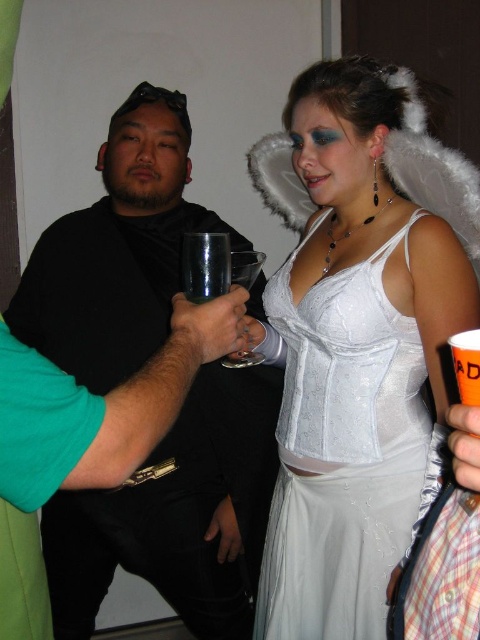
You are at a costume party and see the black matte shirt at left and the satin white dress at center. Which one is positioned more to the left side of the scene?

The black matte shirt at left is positioned more to the left side of the scene than the satin white dress at center.

What is located at the coordinates point (178, 515) in the image?

The black matte shirt at left is located at point (178, 515).

You are a photographer at the event and want to capture both the black matte shirt at left and the satin white dress at center in the same frame. Which clothing item is wider so you can adjust your camera angle accordingly?

The black matte shirt at left is wider than the satin white dress at center, so you should adjust your camera angle to accommodate its greater width.